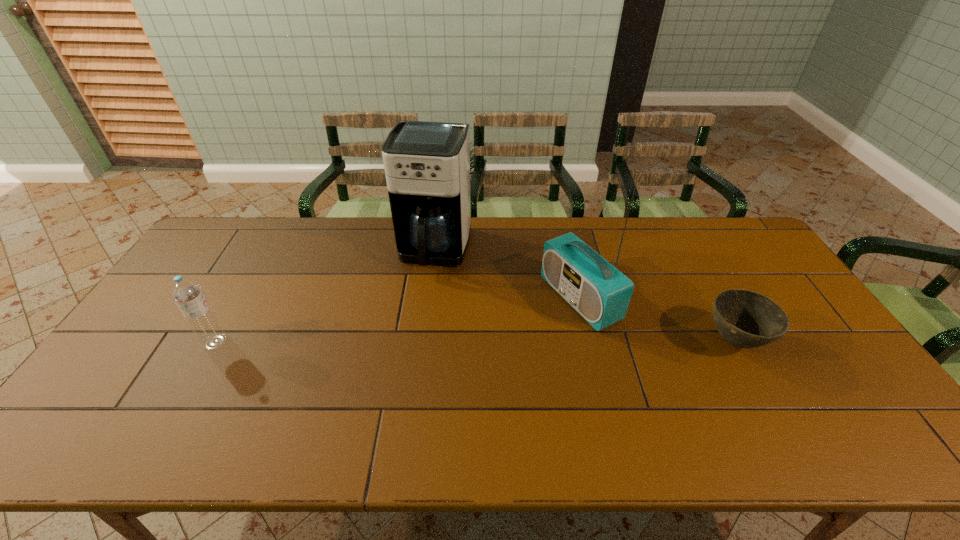
This screenshot has width=960, height=540. I want to click on water bottle, so point(187,294).

Where is `the leftmost object`? The width and height of the screenshot is (960, 540). the leftmost object is located at coordinates (187, 294).

Image resolution: width=960 pixels, height=540 pixels. In order to click on the shortest object in this screenshot , I will do `click(747, 319)`.

Identify the location of the rightmost object. The width and height of the screenshot is (960, 540). (747, 319).

Where is `radio receiver`? radio receiver is located at coordinates (600, 293).

At what (x,y) coordinates should I click in order to perform the action: click on coffee maker. Please return your answer as a coordinate pair (x, y). The image size is (960, 540). Looking at the image, I should click on (427, 164).

The image size is (960, 540). What are the coordinates of `free spot located 0.390m on the back of the leftmost object` in the screenshot? It's located at (270, 246).

Where is `free spot located 0.320m on the back of the rightmost object`? This screenshot has width=960, height=540. free spot located 0.320m on the back of the rightmost object is located at coordinates (684, 249).

Where is `free location located on the front panel of the radio receiver`? Image resolution: width=960 pixels, height=540 pixels. free location located on the front panel of the radio receiver is located at coordinates (456, 359).

At what (x,y) coordinates should I click in order to perform the action: click on vacant space situated on the front panel of the radio receiver. Please return your answer as a coordinate pair (x, y). Looking at the image, I should click on (519, 330).